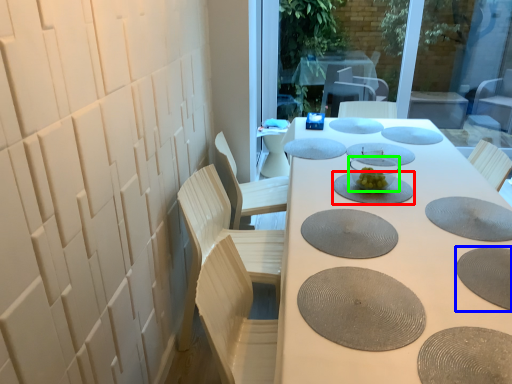
Question: Which object is the closest to the manhole cover (highlighted by a red box)? Choose among these: manhole cover (highlighted by a blue box) or tableware (highlighted by a green box).

Choices:
 (A) manhole cover
 (B) tableware

Answer: (B)